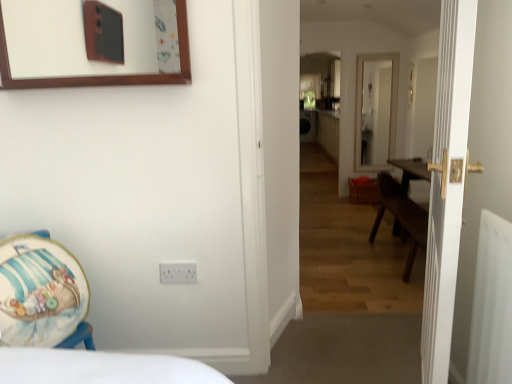
Question: From the image's perspective, is white plastic radiator at right under white wooden door at right?

Choices:
 (A) no
 (B) yes

Answer: (B)

Question: Considering the relative sizes of white plastic radiator at right and white wooden door at right in the image provided, is white plastic radiator at right shorter than white wooden door at right?

Choices:
 (A) yes
 (B) no

Answer: (A)

Question: From a real-world perspective, is white plastic radiator at right below white wooden door at right?

Choices:
 (A) yes
 (B) no

Answer: (A)

Question: Does white plastic radiator at right appear on the right side of white wooden door at right?

Choices:
 (A) yes
 (B) no

Answer: (A)

Question: Is white wooden door at right located within white plastic radiator at right?

Choices:
 (A) yes
 (B) no

Answer: (B)

Question: Considering the relative sizes of white plastic radiator at right and white wooden door at right in the image provided, is white plastic radiator at right bigger than white wooden door at right?

Choices:
 (A) no
 (B) yes

Answer: (A)

Question: Are white plastic electric outlet at lower center and wooden floor at center beside each other?

Choices:
 (A) no
 (B) yes

Answer: (A)

Question: Is white plastic electric outlet at lower center not close to wooden floor at center?

Choices:
 (A) no
 (B) yes

Answer: (B)

Question: Can you confirm if white plastic electric outlet at lower center is wider than wooden floor at center?

Choices:
 (A) yes
 (B) no

Answer: (B)

Question: Is white plastic electric outlet at lower center taller than wooden floor at center?

Choices:
 (A) no
 (B) yes

Answer: (A)

Question: From a real-world perspective, is white plastic electric outlet at lower center positioned under wooden floor at center based on gravity?

Choices:
 (A) yes
 (B) no

Answer: (A)

Question: From a real-world perspective, is white plastic electric outlet at lower center on top of wooden floor at center?

Choices:
 (A) yes
 (B) no

Answer: (B)

Question: From a real-world perspective, is white wooden door at right located higher than white plastic radiator at right?

Choices:
 (A) no
 (B) yes

Answer: (B)